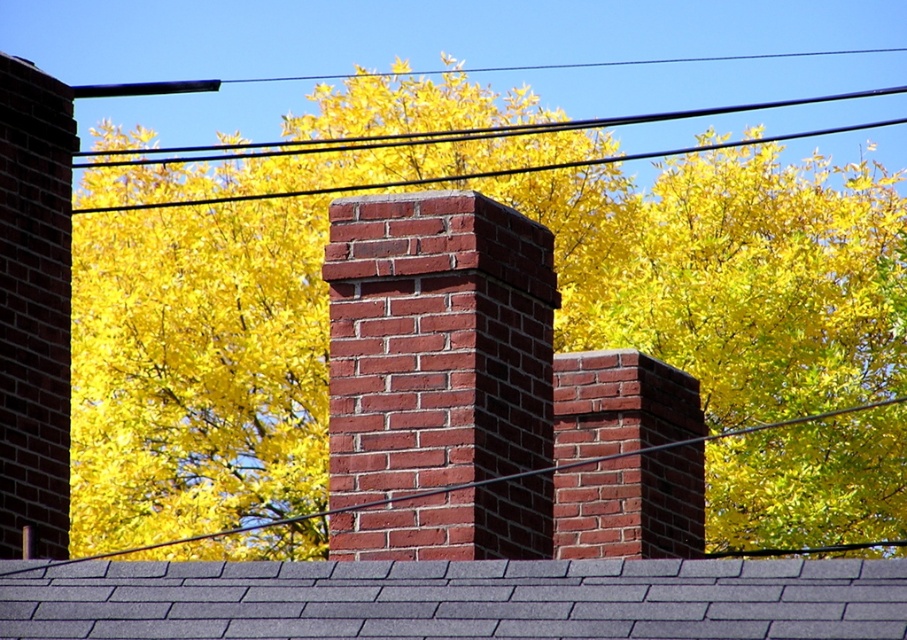
You are standing on the roof and looking upwards. You see a yellow leafy tree at upper center and a black wire at upper center. Which object is closer to you?

The yellow leafy tree at upper center is closer to you since it is further to the viewer than the black wire at upper center.

You are a maintenance worker standing on the roof and need to reach the black wire at upper center from the gray shingles at center. Can you safely reach it with a 8 meter ladder?

The distance between the gray shingles at center and the black wire at upper center is 7.97 meters. Since the ladder is 8 meters long, it is just long enough to safely reach the black wire at upper center from the gray shingles at center.